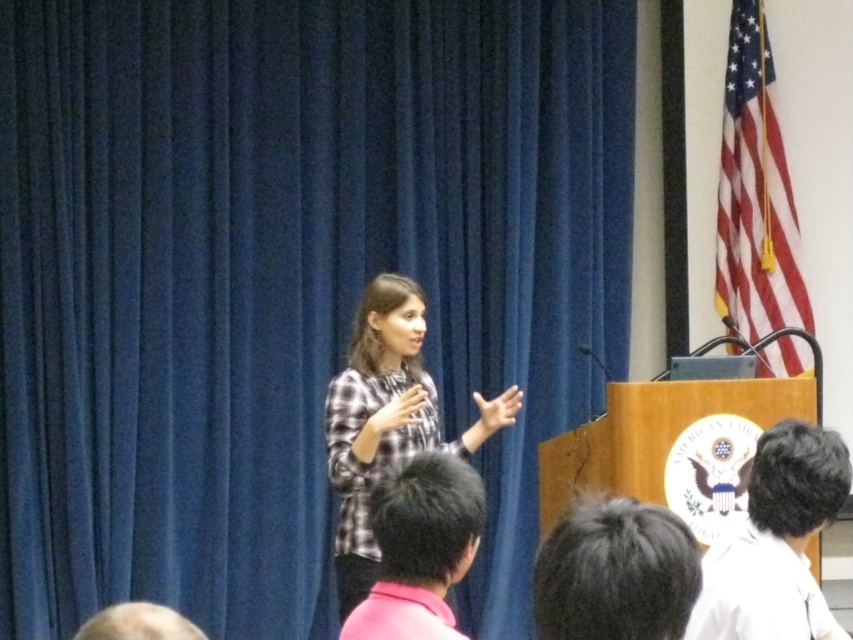
You are an event planner setting up a stage for a presentation. You need to ensure that the black hair at upper center and the pink fabric head at lower center are visible to the audience. Based on their sizes, which object should be placed closer to the front of the stage to ensure visibility?

The black hair at upper center has a lesser width compared to the pink fabric head at lower center. To ensure visibility, the smaller black hair at upper center should be placed closer to the front of the stage so that it can be seen clearly alongside the larger pink fabric head at lower center.

You are an attendee at this presentation. You want to take a photo of the speaker without using a zoom lens. The speaker is standing at the podium, and you are positioned such that the point at coordinates point (495, 420) is 3.32 meters away from you. Can you clearly capture the speaker in your photo?

The point (495, 420) is 3.32 meters away from the viewer. Since this point is likely near the speaker at the podium, you can clearly capture the speaker in your photo as they are within a reasonable distance for a non zoom lens.